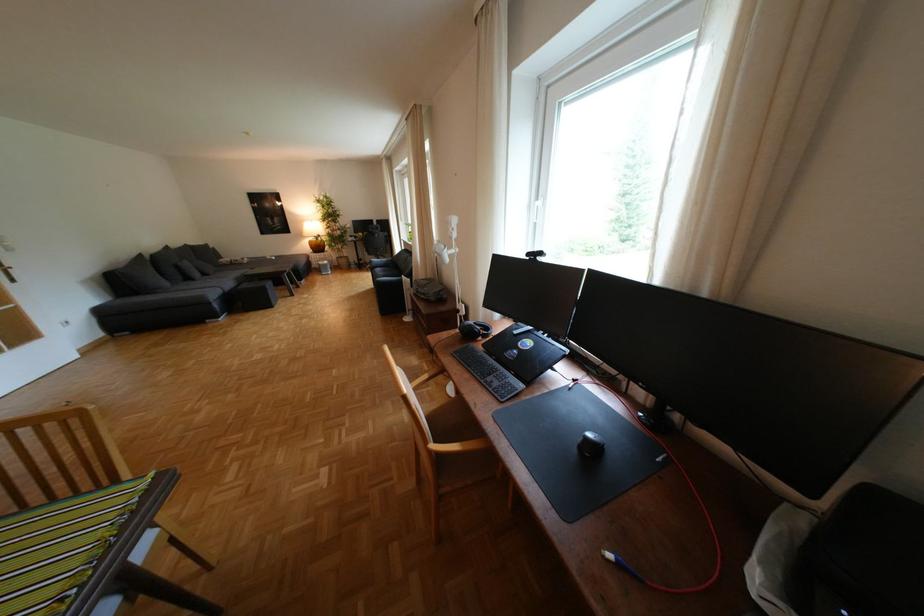
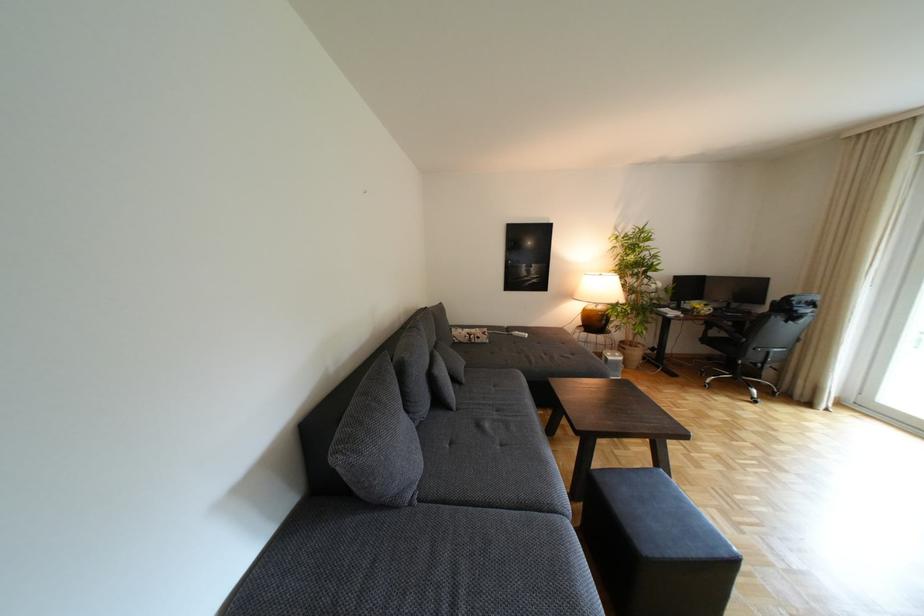
The point at (216, 274) is marked in the first image. Where is the corresponding point in the second image?

(468, 379)